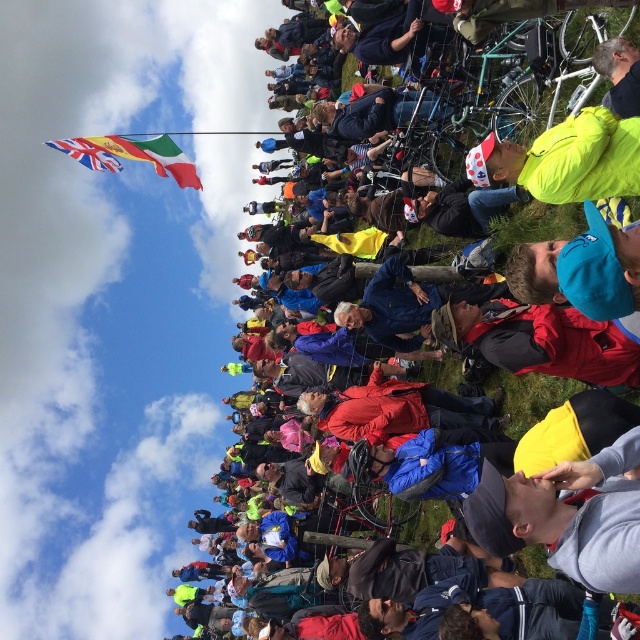
Question: Which is farther from the yellow jacket at upper right?

Choices:
 (A) blue fabric jacket at upper center
 (B) union jack fabric flag at upper left
 (C) neon yellow jacket at center

Answer: (B)

Question: Which object is closer to the camera taking this photo?

Choices:
 (A) union jack fabric flag at upper left
 (B) neon yellow jacket at center
 (C) blue fabric jacket at upper center

Answer: (B)

Question: Is blue fabric jacket at upper center below yellow jacket at upper right?

Choices:
 (A) no
 (B) yes

Answer: (B)

Question: Can you confirm if neon yellow jacket at center is wider than union jack fabric flag at upper left?

Choices:
 (A) no
 (B) yes

Answer: (A)

Question: Which of these objects is positioned closest to the neon yellow jacket at center?

Choices:
 (A) union jack fabric flag at upper left
 (B) blue fabric jacket at upper center
 (C) yellow jacket at upper right

Answer: (C)

Question: Is the position of neon yellow jacket at center less distant than that of union jack fabric flag at upper left?

Choices:
 (A) no
 (B) yes

Answer: (B)